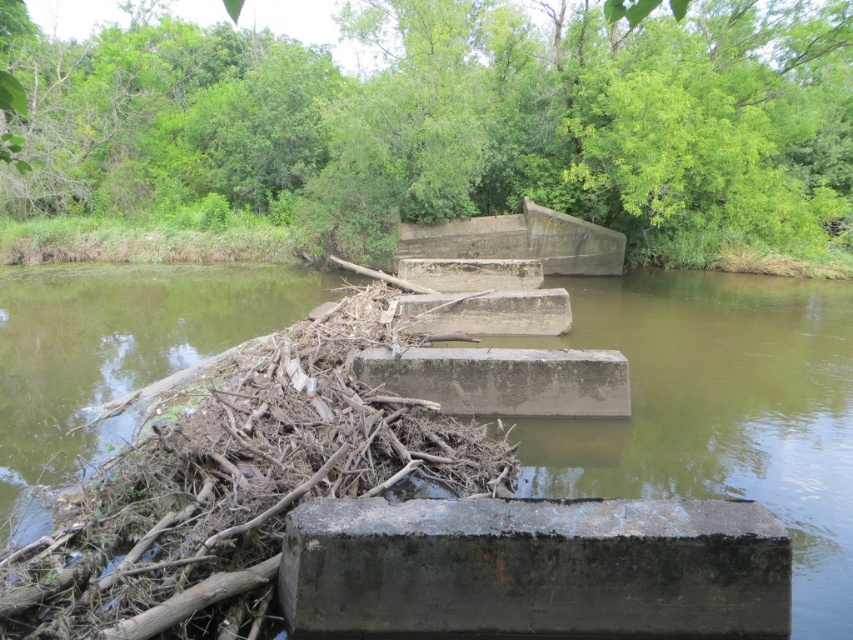
Question: Which of these objects is positioned closest to the gray concrete block at center?

Choices:
 (A) dark gray concrete block at center
 (B) concrete blocks at center

Answer: (B)

Question: Is concrete blocks at center positioned in front of dark gray concrete block at center?

Choices:
 (A) no
 (B) yes

Answer: (A)

Question: Estimate the real-world distances between objects in this image. Which object is farther from the dark gray concrete block at center?

Choices:
 (A) gray concrete block at center
 (B) concrete blocks at center

Answer: (B)

Question: Considering the relative positions of concrete blocks at center and dark gray concrete block at center in the image provided, where is concrete blocks at center located with respect to dark gray concrete block at center?

Choices:
 (A) left
 (B) right

Answer: (B)

Question: Based on their relative distances, which object is nearer to the dark gray concrete block at center?

Choices:
 (A) gray concrete block at center
 (B) concrete blocks at center

Answer: (A)

Question: Where is concrete blocks at center located in relation to gray concrete block at center in the image?

Choices:
 (A) left
 (B) right

Answer: (B)